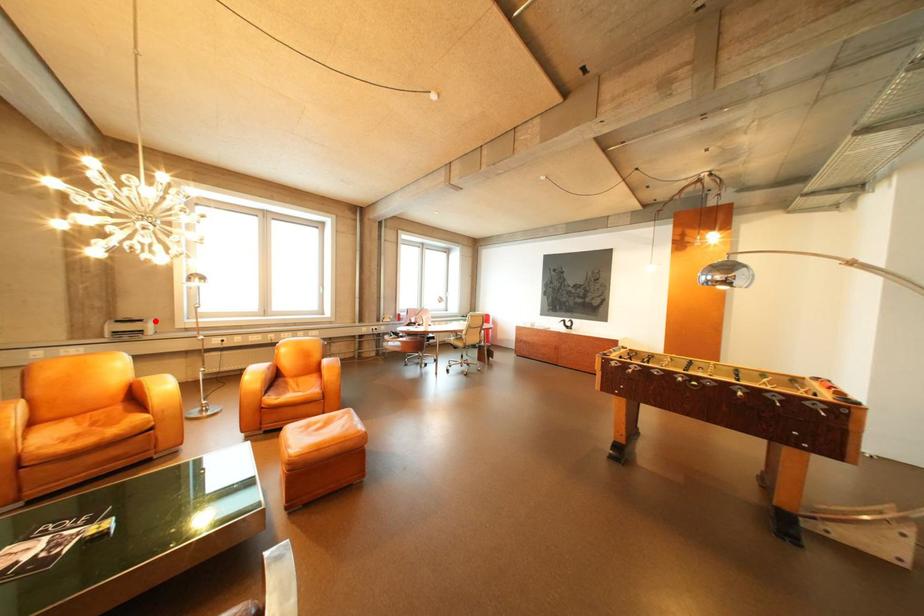
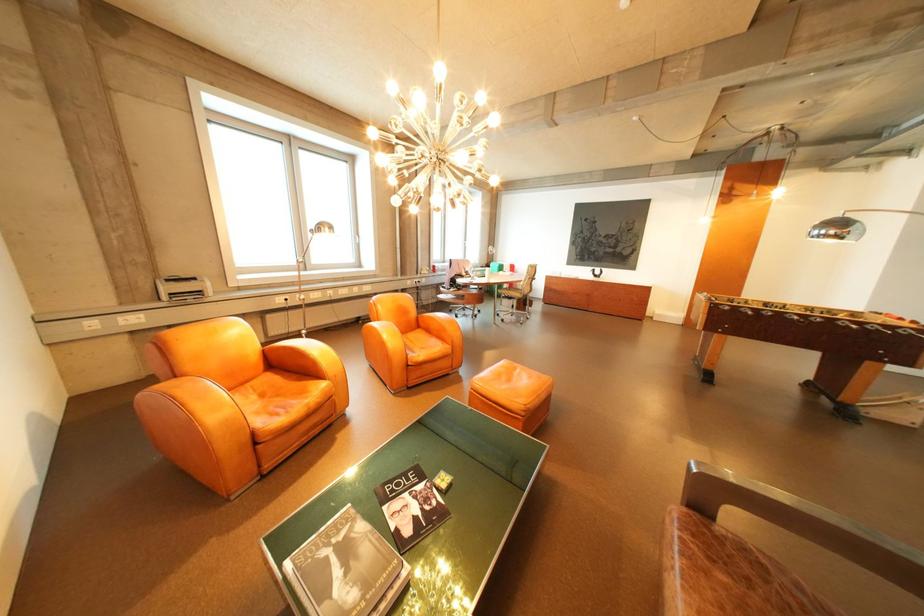
The point at the highlighted location is marked in the first image. Where is the corresponding point in the second image?

(208, 280)